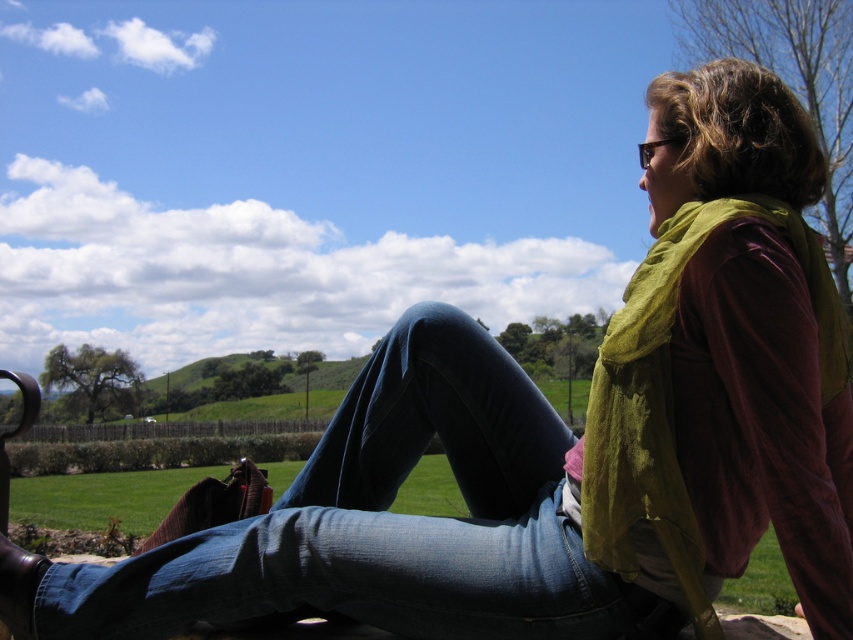
Question: Is denim at center bigger than green sheer scarf at upper right?

Choices:
 (A) yes
 (B) no

Answer: (A)

Question: From the image, what is the correct spatial relationship of denim at center in relation to green sheer scarf at upper right?

Choices:
 (A) below
 (B) above

Answer: (A)

Question: Is denim at center closer to camera compared to green sheer scarf at upper right?

Choices:
 (A) no
 (B) yes

Answer: (A)